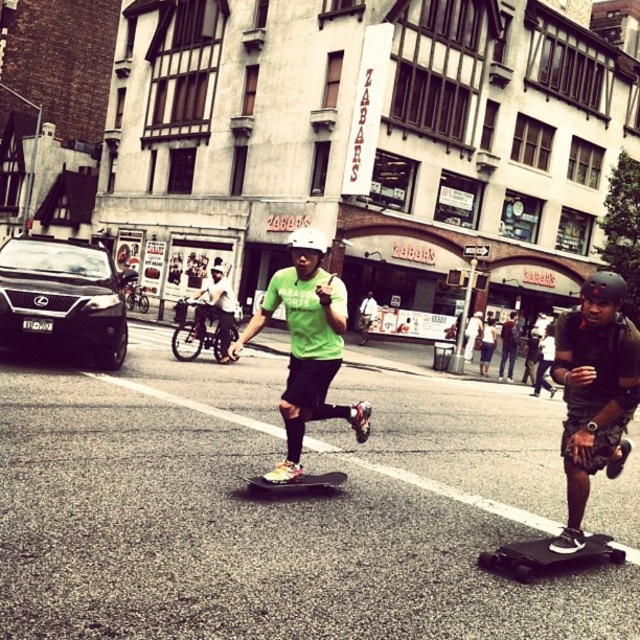
Looking at this image, please provide the 2D coordinates of the white matte helmet at center in the scene.

The 2D coordinates of the white matte helmet at center are at point (307, 250).

You are a safety inspector checking the helmets of skateboarders in the urban street scene. Both skateboarders are wearing helmets, one with a white matte helmet at center and the other with a dark gray helmet at center. According to safety regulations, helmets must be at least 12 inches in diameter. Can you determine if both helmets meet the size requirement based on their relative sizes?

The white matte helmet at center is larger than the dark gray helmet at center. Since the minimum required diameter is 12 inches, if the white matte helmet meets or exceeds this size, the dark gray helmet at center, being smaller, might not comply. However, without exact measurements, we cannot confirm both meet the requirement definitively.